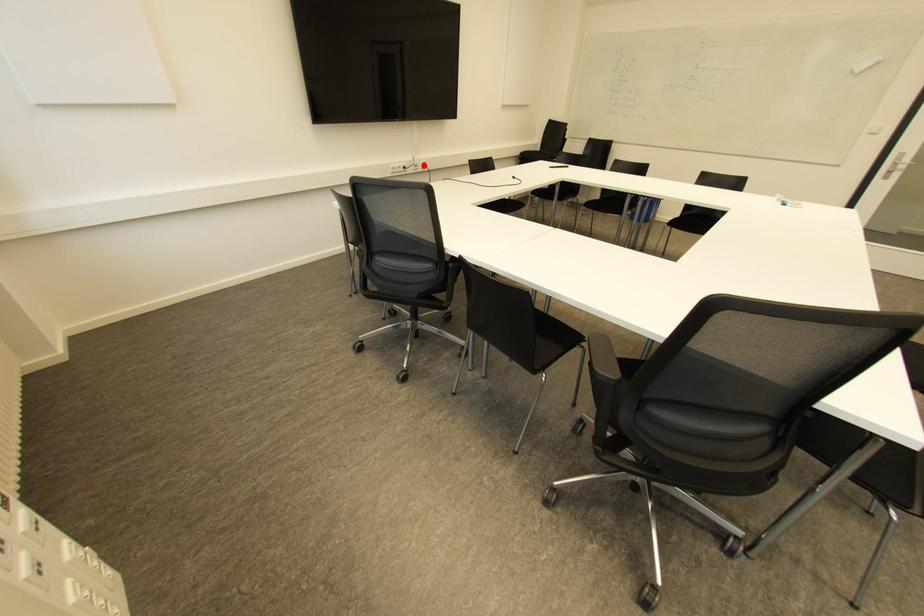
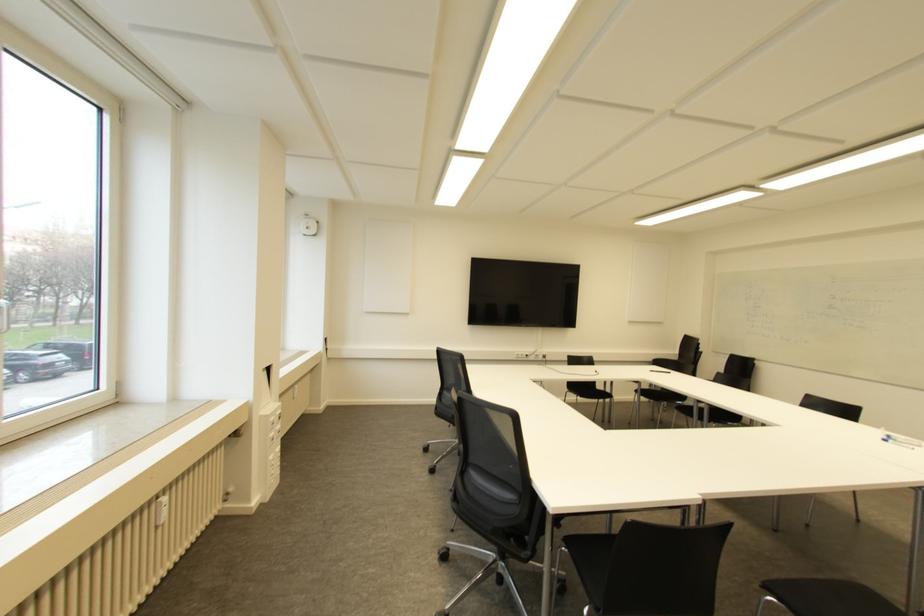
The point at the highlighted location is marked in the first image. Where is the corresponding point in the second image?

(543, 355)